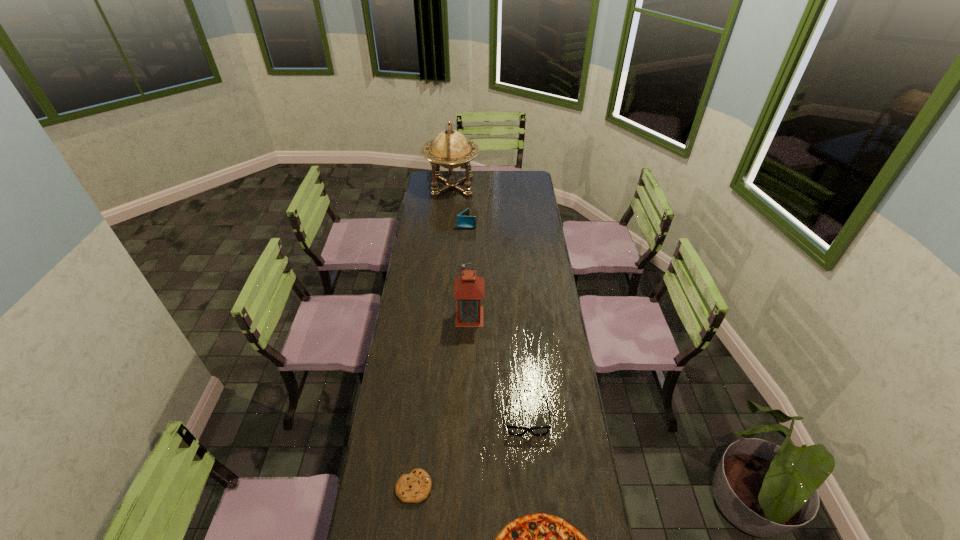
In order to click on vacant space that is in between the second nearest object and the fourth nearest object in this screenshot , I will do `click(442, 401)`.

This screenshot has width=960, height=540. Identify the location of vacant area that lies between the lantern and the tallest object. (461, 251).

What are the coordinates of `object that is the third closest one to the fourth nearest object` in the screenshot? It's located at (464, 221).

Identify the location of the sixth closest object to the second nearest object. Image resolution: width=960 pixels, height=540 pixels. (450, 149).

Where is `free space that satisfies the following two spatial constraints: 1. on the front-facing side of the igniter; 2. on the left side of the globe`? Image resolution: width=960 pixels, height=540 pixels. free space that satisfies the following two spatial constraints: 1. on the front-facing side of the igniter; 2. on the left side of the globe is located at coordinates (444, 279).